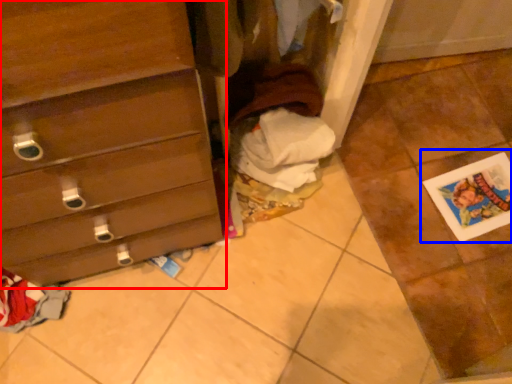
Question: Which point is further to the camera, chest of drawers (highlighted by a red box) or postcard (highlighted by a blue box)?

Choices:
 (A) chest of drawers
 (B) postcard

Answer: (B)